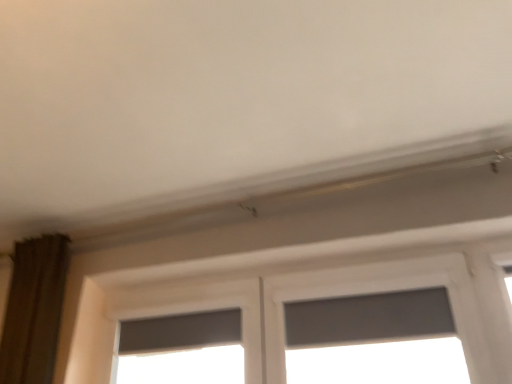
Question: Is matte gray window at center outside gray matte window screen at center?

Choices:
 (A) yes
 (B) no

Answer: (A)

Question: Can you confirm if matte gray window at center is wider than gray matte window screen at center?

Choices:
 (A) no
 (B) yes

Answer: (A)

Question: Is matte gray window at center oriented away from gray matte window screen at center?

Choices:
 (A) yes
 (B) no

Answer: (B)

Question: Is matte gray window at center positioned behind gray matte window screen at center?

Choices:
 (A) yes
 (B) no

Answer: (A)

Question: From the image's perspective, is matte gray window at center beneath gray matte window screen at center?

Choices:
 (A) no
 (B) yes

Answer: (B)

Question: Is matte gray window at center facing towards gray matte window screen at center?

Choices:
 (A) no
 (B) yes

Answer: (A)

Question: Is gray matte window screen at center further to camera compared to matte gray window at center?

Choices:
 (A) yes
 (B) no

Answer: (B)

Question: Can you confirm if gray matte window screen at center is bigger than matte gray window at center?

Choices:
 (A) no
 (B) yes

Answer: (B)

Question: Does gray matte window screen at center have a lesser width compared to matte gray window at center?

Choices:
 (A) yes
 (B) no

Answer: (B)

Question: From the image's perspective, is gray matte window screen at center under matte gray window at center?

Choices:
 (A) no
 (B) yes

Answer: (A)

Question: Does gray matte window screen at center come in front of matte gray window at center?

Choices:
 (A) no
 (B) yes

Answer: (B)

Question: From the image's perspective, is gray matte window screen at center above matte gray window at center?

Choices:
 (A) no
 (B) yes

Answer: (B)

Question: From a real-world perspective, relative to matte gray window at center, is gray matte window screen at center vertically above or below?

Choices:
 (A) below
 (B) above

Answer: (A)